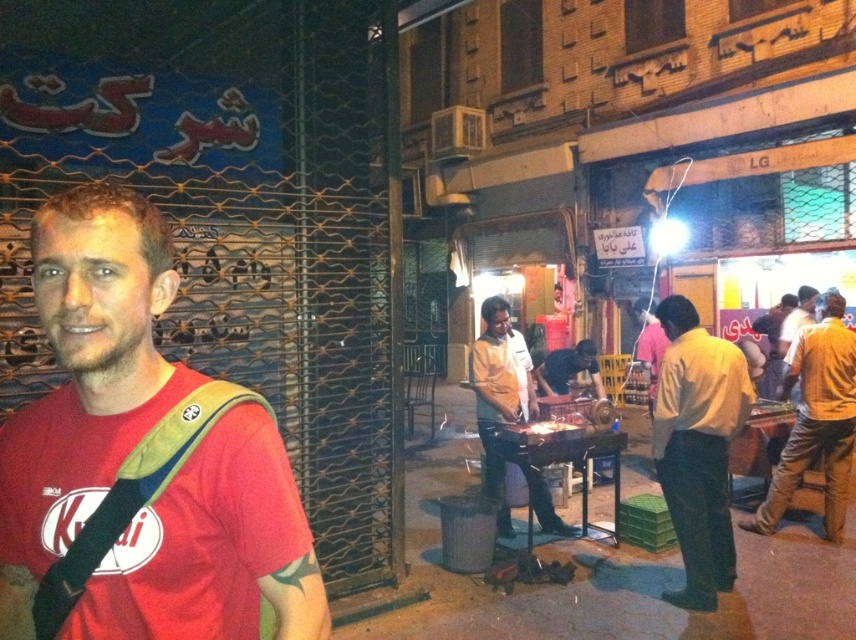
Does red matte shirt at center have a smaller size compared to yellow shirt at center?

Correct, red matte shirt at center occupies less space than yellow shirt at center.

Which is behind, point (192, 419) or point (706, 416)?

The point (706, 416) is more distant.

Which is in front, point (169, 289) or point (718, 440)?

Positioned in front is point (169, 289).

Where is `red matte shirt at center`? The width and height of the screenshot is (856, 640). red matte shirt at center is located at coordinates (141, 460).

Between red matte shirt at center and light brown shirt at center, which one has less height?

Standing shorter between the two is red matte shirt at center.

Between point (155, 358) and point (533, 500), which one is positioned in front?

Point (155, 358)

The image size is (856, 640). I want to click on red matte shirt at center, so click(x=141, y=460).

Does yellow cotton shirt at right lie behind light brown shirt at center?

Yes.

Does yellow cotton shirt at right have a greater width compared to light brown shirt at center?

Indeed, yellow cotton shirt at right has a greater width compared to light brown shirt at center.

Image resolution: width=856 pixels, height=640 pixels. Describe the element at coordinates (816, 420) in the screenshot. I see `yellow cotton shirt at right` at that location.

Locate an element on the screen. yellow cotton shirt at right is located at coordinates (816, 420).